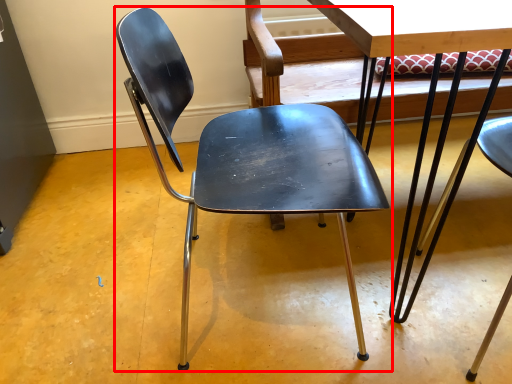
Question: Considering the relative positions of chair (annotated by the red box) and table in the image provided, where is chair (annotated by the red box) located with respect to the staircase?

Choices:
 (A) right
 (B) left

Answer: (B)